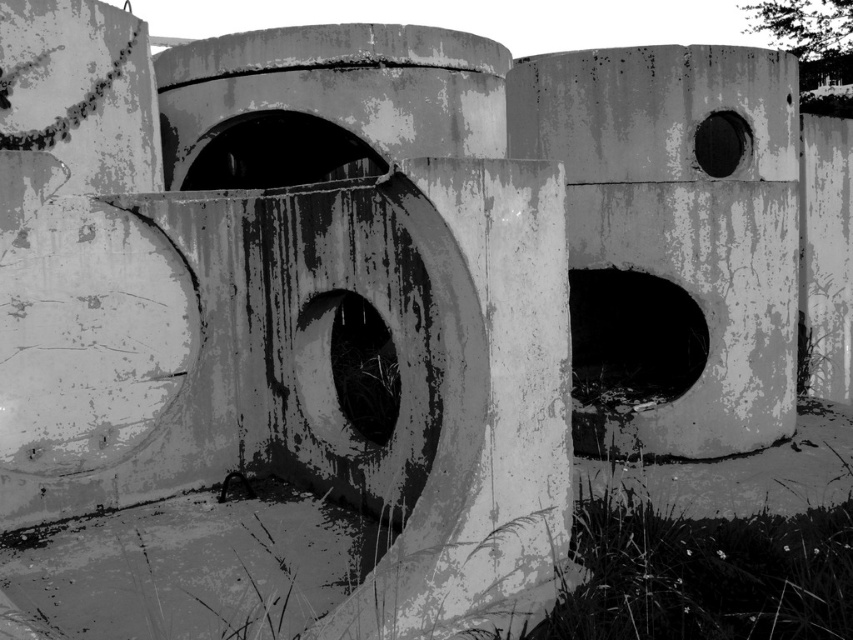
You are a maintenance worker needing to inspect both the rusty concrete pillar at center and the concrete wall at center. Given that your inspection equipment has a maximum reach of 10 feet, can you inspect both objects without moving your equipment?

The rusty concrete pillar at center and the concrete wall at center are 10.87 feet apart from each other. Since the equipment has a maximum reach of 10 feet, which is less than the distance between them, you cannot inspect both objects without moving your equipment.

You are an architect inspecting the site. You need to determine if the rusty concrete pillar at center can be moved closer to the concrete wall at center without overlapping. Based on their sizes, is this possible?

The rusty concrete pillar at center is smaller than the concrete wall at center. Since the pillar is smaller, it can be moved closer to the wall without overlapping as long as there is sufficient space between them to accommodate their sizes.

You are an architect reviewing this image. You need to determine the spatial relationship between the rusty concrete pillar at center and the concrete wall at center. Which object is positioned lower in the scene?

The rusty concrete pillar at center is located below the concrete wall at center, so it is positioned lower in the scene.